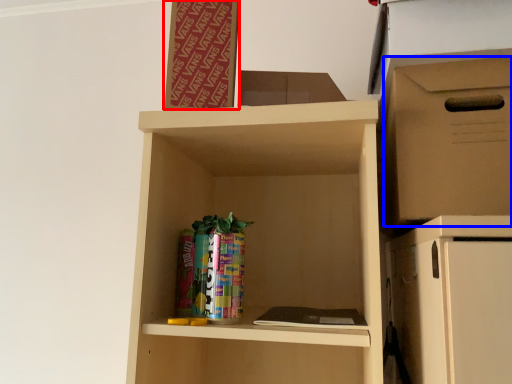
Question: Which object is closer to the camera taking this photo, bulletin board (highlighted by a red box) or storage box (highlighted by a blue box)?

Choices:
 (A) bulletin board
 (B) storage box

Answer: (B)